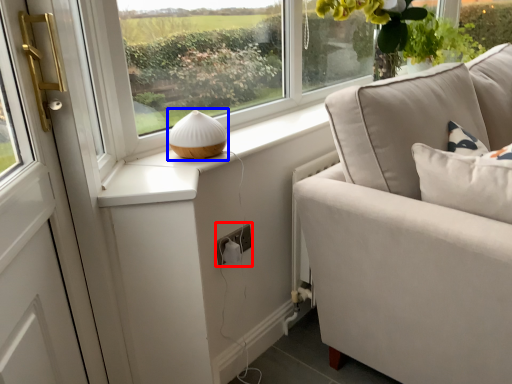
Question: Among these objects, which one is farthest to the camera, electric outlet (highlighted by a red box) or table lamp (highlighted by a blue box)?

Choices:
 (A) electric outlet
 (B) table lamp

Answer: (A)